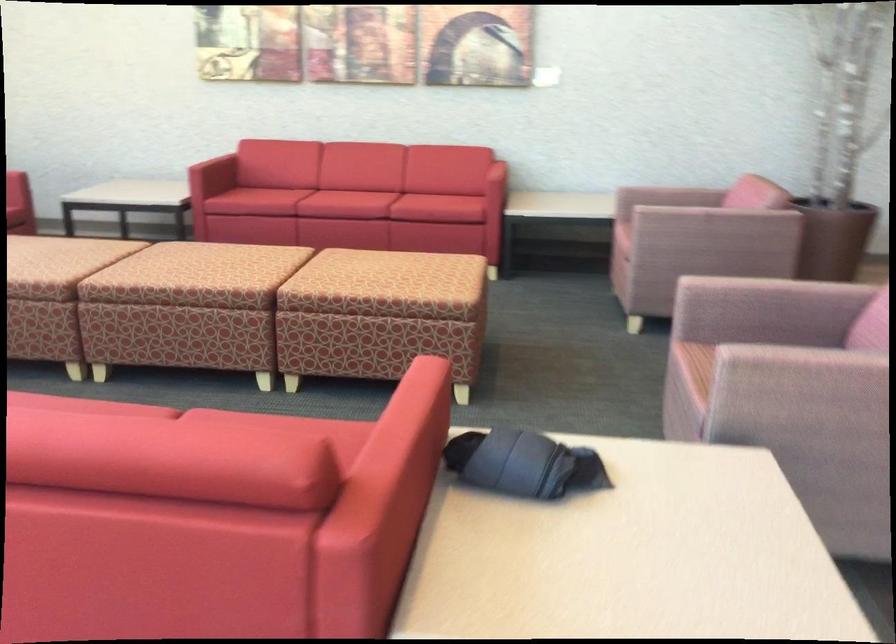
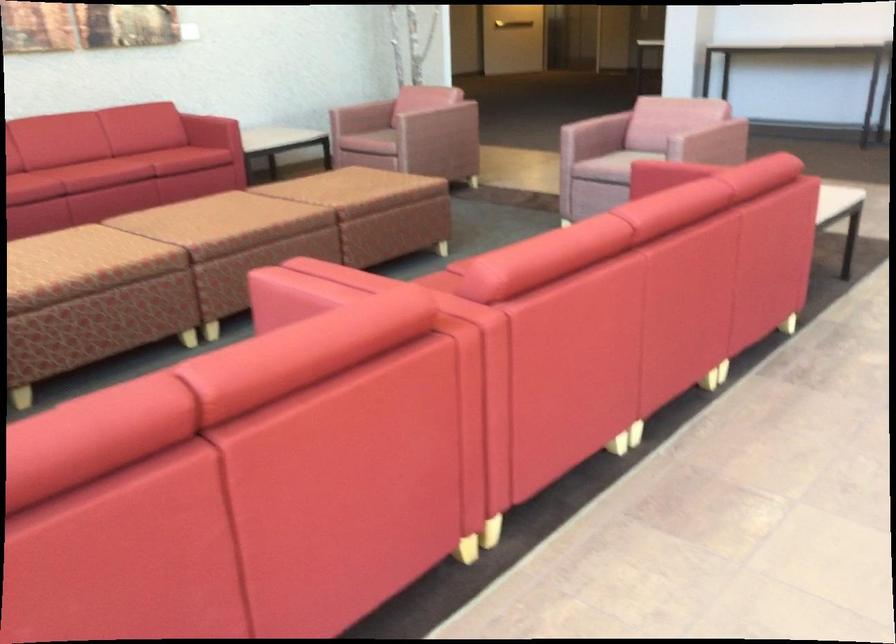
Question: I am providing you with two images of the same scene from different viewpoints. After the viewpoint changes to image2, which objects are now occluded?

Choices:
 (A) patterned ottoman surface
 (B) light brown pillow
 (C) horizontal door handle
 (D) pink chair sitting surface

Answer: (A)